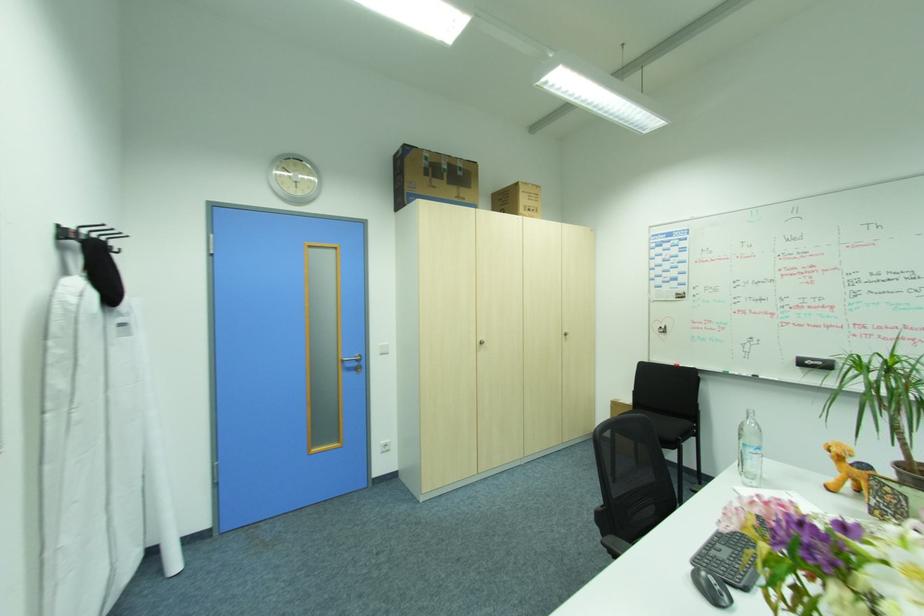
Which object does [517,199] point to?

This point indicates the small cardboard box.